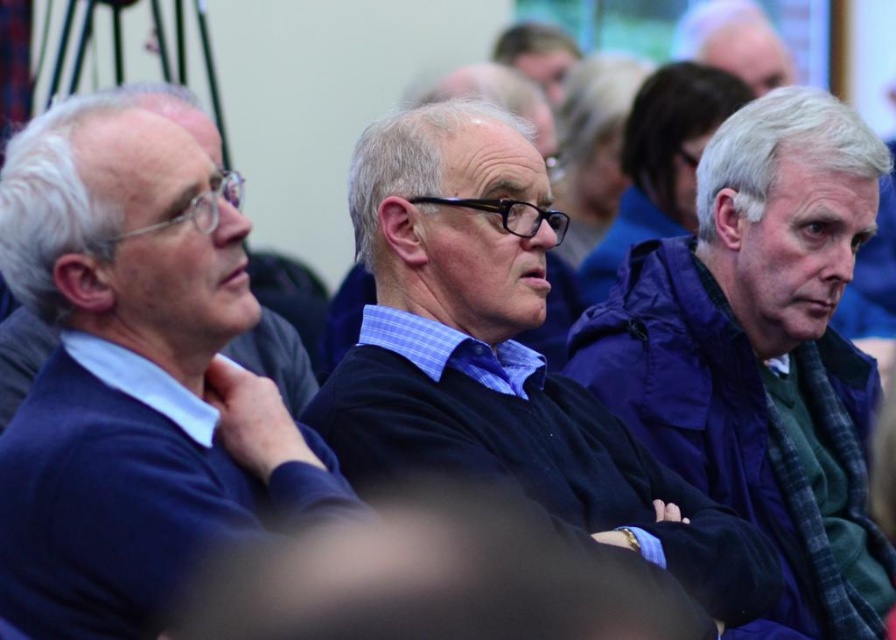
You are organizing a clothing donation drive and need to determine if the dark blue sweater at left and the dark blue sweater at center can be placed side by side on a shelf that is 1.2 meters wide. Based on the image, can you confirm if they will fit?

The dark blue sweater at left might be wider than dark blue sweater at center. However, without exact measurements, it is uncertain if their combined width exceeds 1.2 meters. Further measurement is required.

In the scene, there are three men seated together. The man on the left is wearing a dark blue sweater over a collared shirt, the central figure has a checkered shirt under his dark blue sweater, and the third man is wearing a purple fabric jacket at right. Based on their positions, which man is seated farthest to the right?

The man wearing the purple fabric jacket at right is seated farthest to the right since his jacket is positioned at point (x=762, y=349), indicating he is on the rightmost side.